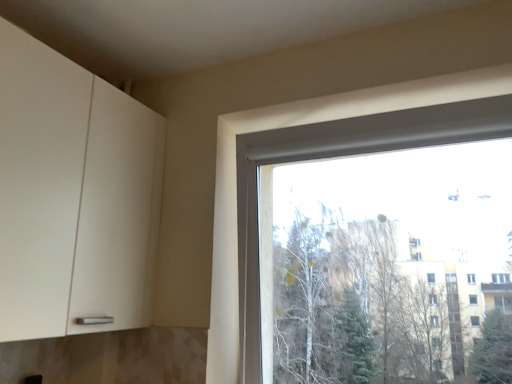
The image size is (512, 384). Describe the element at coordinates (336, 155) in the screenshot. I see `transparent glass window at upper right` at that location.

At what (x,y) coordinates should I click in order to perform the action: click on transparent glass window at upper right. Please return your answer as a coordinate pair (x, y). Image resolution: width=512 pixels, height=384 pixels. Looking at the image, I should click on (336, 155).

This screenshot has height=384, width=512. Find the location of `transparent glass window at upper right`. transparent glass window at upper right is located at coordinates (336, 155).